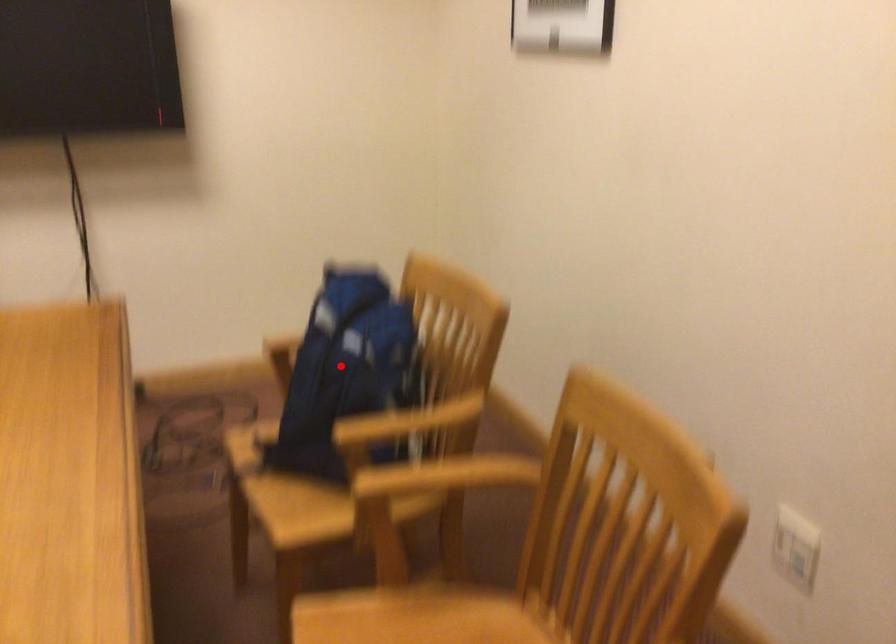
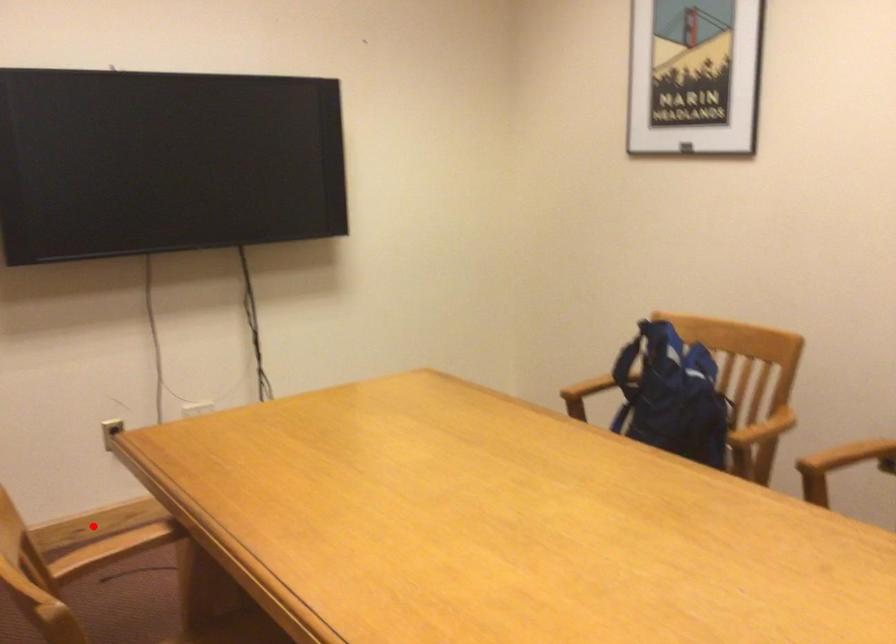
I am providing you with two images of the same scene from different viewpoints. A red point is marked on the first image and another point is marked on the second image. Is the marked point in image1 the same physical position as the marked point in image2?

No